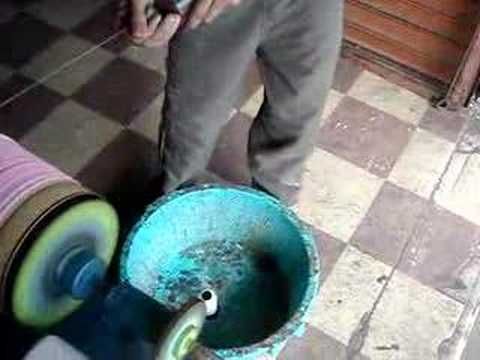
The image size is (480, 360). I want to click on black handle, so click(x=172, y=10).